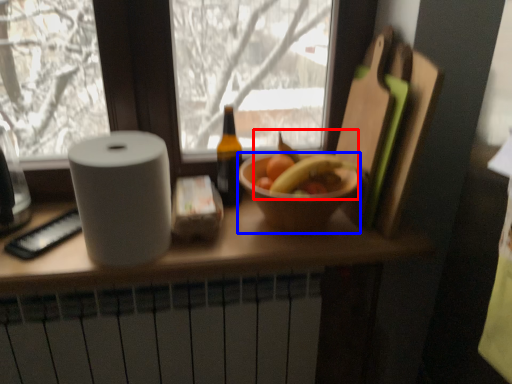
Question: Which object appears closest to the camera in this image, fruit (highlighted by a red box) or bowl (highlighted by a blue box)?

Choices:
 (A) fruit
 (B) bowl

Answer: (B)